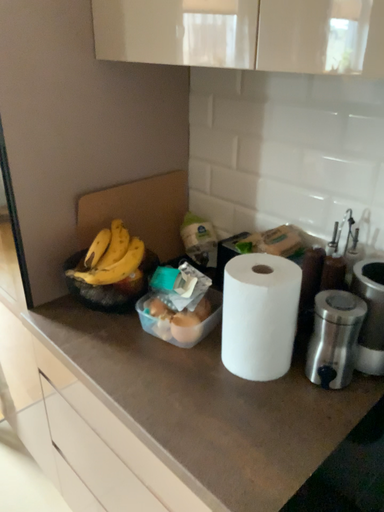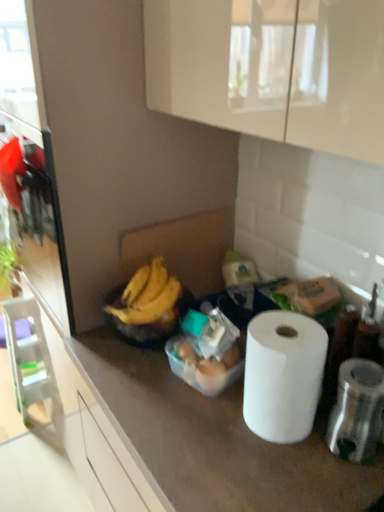
Question: How did the camera likely rotate when shooting the video?

Choices:
 (A) rotated left
 (B) rotated right

Answer: (A)